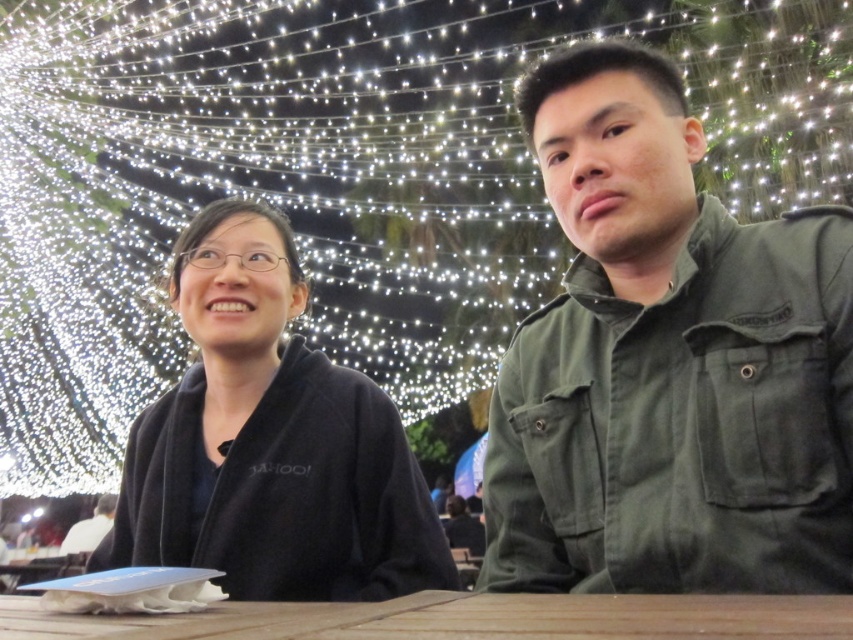
What do you see at coordinates (270, 442) in the screenshot?
I see `black fleece jacket at left` at bounding box center [270, 442].

Is black fleece jacket at left positioned behind brown wooden table at center?

Yes, it is behind brown wooden table at center.

At what (x,y) coordinates should I click in order to perform the action: click on black fleece jacket at left. Please return your answer as a coordinate pair (x, y). The height and width of the screenshot is (640, 853). Looking at the image, I should click on (270, 442).

Is point (616, 276) farther from viewer compared to point (102, 500)?

No, (616, 276) is closer to viewer.

From the picture: Is green matte jacket at right further to the viewer compared to dark green jacket at center?

No.

Is point (817, 273) more distant than point (103, 502)?

No, (817, 273) is closer to viewer.

Find the location of a particular element. green matte jacket at right is located at coordinates (668, 364).

Between point (293, 538) and point (91, 529), which one is positioned in front?

Point (293, 538) is more forward.

Is black fleece jacket at left bigger than dark green jacket at center?

Indeed, black fleece jacket at left has a larger size compared to dark green jacket at center.

Does point (161, 556) come farther from viewer compared to point (80, 547)?

That is False.

Identify the location of black fleece jacket at left. The width and height of the screenshot is (853, 640). (270, 442).